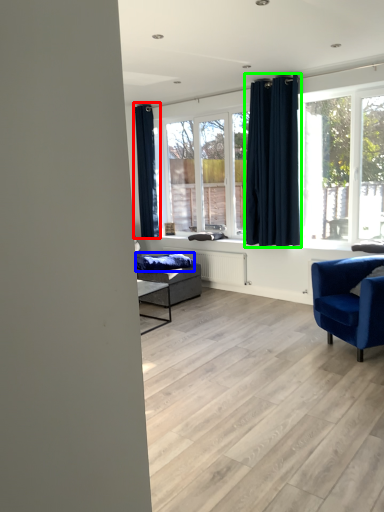
Question: Which object is the closest to the curtain (highlighted by a red box)? Choose among these: blanket (highlighted by a blue box) or curtain (highlighted by a green box).

Choices:
 (A) blanket
 (B) curtain

Answer: (A)